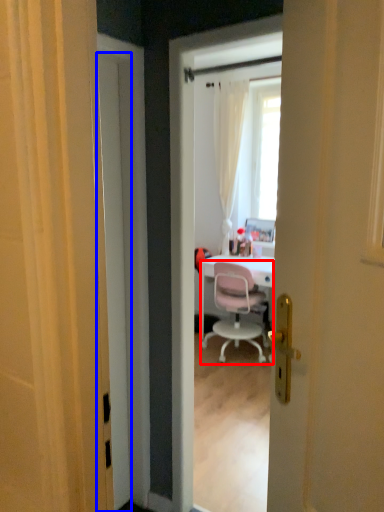
Question: Which of the following is the farthest to the observer, chair (highlighted by a red box) or door (highlighted by a blue box)?

Choices:
 (A) chair
 (B) door

Answer: (A)